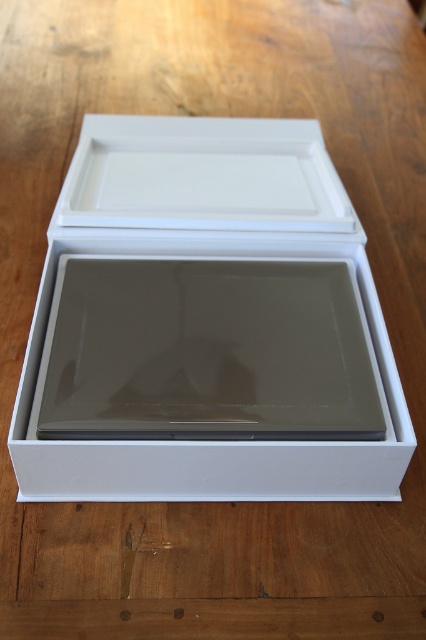
You are organizing items on a desk and need to place both the white matte box at center and the white matte tray at upper center. Considering their sizes, which one should you place first to ensure stability?

The white matte box at center is larger than the white matte tray at upper center, so placing the box first will provide a stable base for the tray to be placed on top or beside it.

You are organizing items on a desk and need to place both the white matte box at center and the white matte tray at upper center. Based on their positions in the image, which one is closer to you?

The white matte box at center is closer to you because it is in front of the white matte tray at upper center.